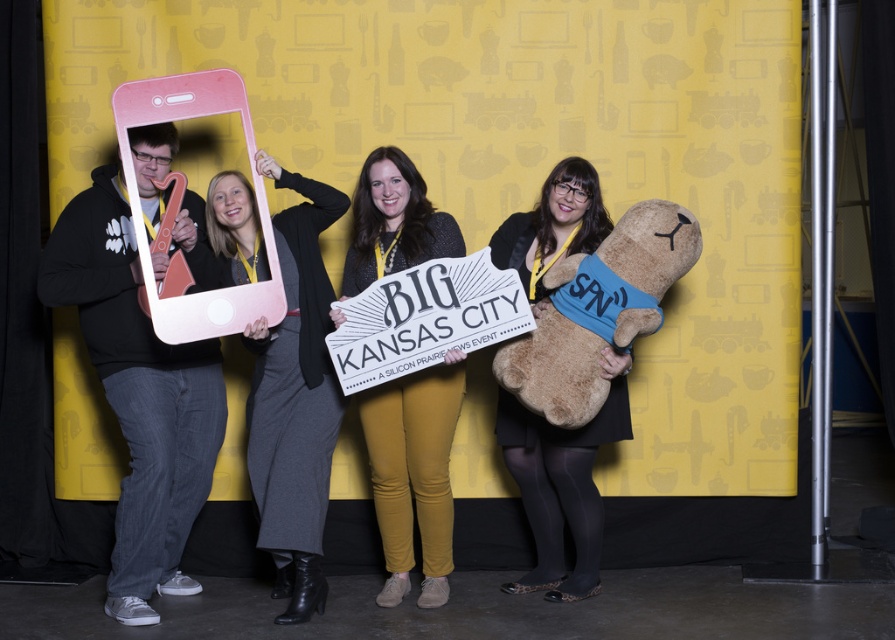
You are standing in front of the photo backdrop. Where is the matte pink phone at left positioned relative to the center of the backdrop?

The matte pink phone at left is positioned to the lower left of the center of the backdrop because its coordinates are at point (138, 394), which places it below and to the left of the center point.

You are a photographer at the event and need to ensure that the matte pink phone at left is visible in the photo. Considering the gray woolen pants at center might block the view, is the phone likely to be visible?

The matte pink phone at left is larger in size than gray woolen pants at center, so it is likely visible even if partially obscured by the pants.

You are standing in front of the photo backdrop and want to place a new decorative item at the exact center of the image. However, you notice there is already an object at point (138, 394). Can you confirm if this existing object is located to the left or right of the image center?

The existing object at point (138, 394) is located to the left of the image center because the x coordinate 0.617 is less than 0.5, which would be the center point.